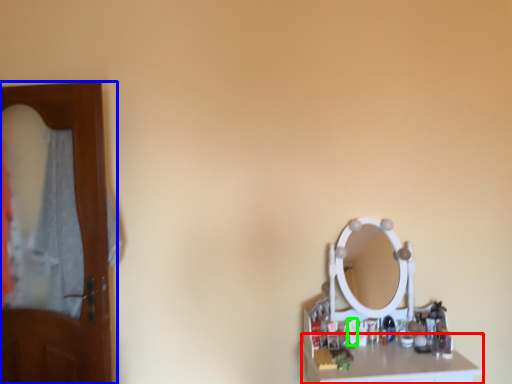
Question: Considering the real-world distances, which object is closest to counter top (highlighted by a red box)? door (highlighted by a blue box) or toiletry (highlighted by a green box).

Choices:
 (A) door
 (B) toiletry

Answer: (B)